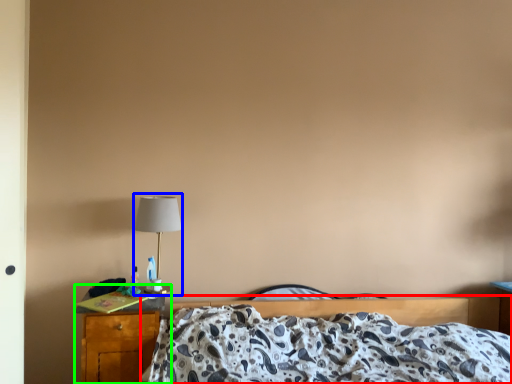
Question: Which is nearer to the bed (highlighted by a red box)? table lamp (highlighted by a blue box) or nightstand (highlighted by a green box).

Choices:
 (A) table lamp
 (B) nightstand

Answer: (B)